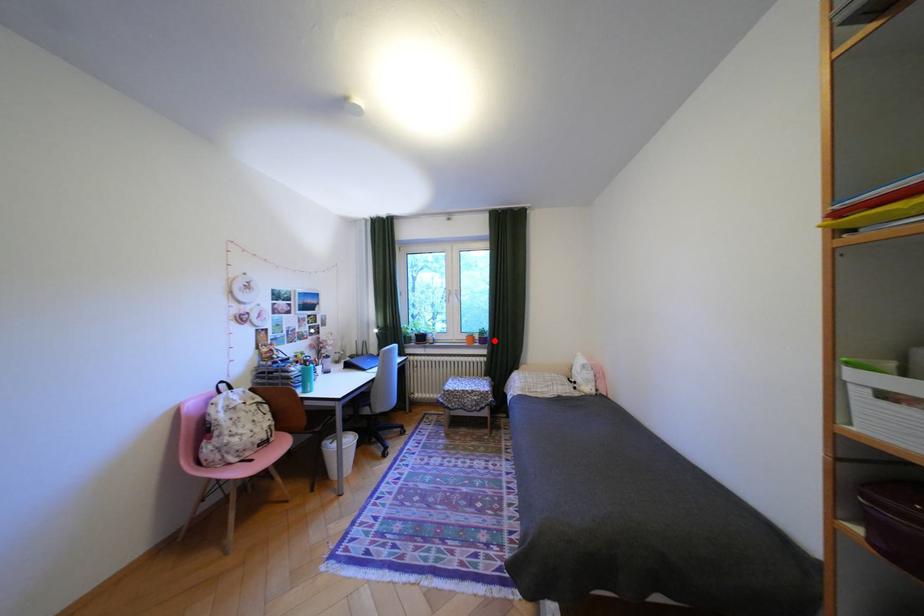
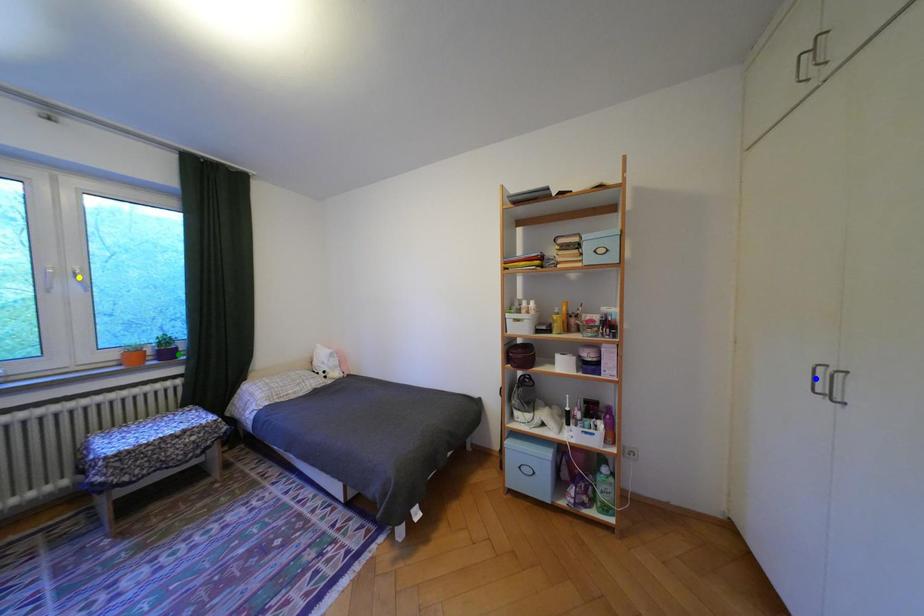
Question: I am providing you with two images of the same scene from different viewpoints. A red point is marked on the first image. You are given multiple points on the second image. Which spot in image 2 lines up with the point in image 1?

Choices:
 (A) green point
 (B) blue point
 (C) yellow point

Answer: (A)